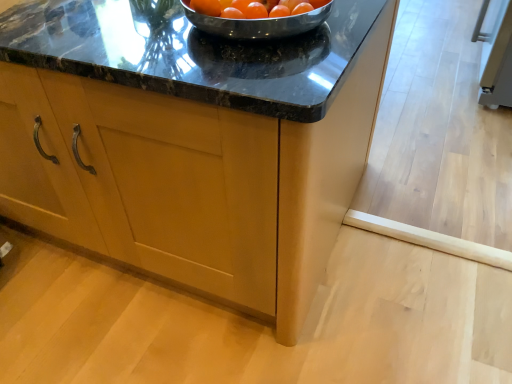
Question: Is matte wood cabinet at center taller than orange matte tomato at center?

Choices:
 (A) yes
 (B) no

Answer: (A)

Question: Can you confirm if matte wood cabinet at center is bigger than orange matte tomato at center?

Choices:
 (A) no
 (B) yes

Answer: (B)

Question: Does matte wood cabinet at center have a smaller size compared to orange matte tomato at center?

Choices:
 (A) yes
 (B) no

Answer: (B)

Question: From a real-world perspective, is matte wood cabinet at center physically above orange matte tomato at center?

Choices:
 (A) no
 (B) yes

Answer: (A)

Question: From a real-world perspective, is matte wood cabinet at center below orange matte tomato at center?

Choices:
 (A) yes
 (B) no

Answer: (A)

Question: Is orange matte tomato at center surrounded by matte wood cabinet at center?

Choices:
 (A) no
 (B) yes

Answer: (A)

Question: Is orange matte tomato at center completely or partially outside of matte wood cabinet at center?

Choices:
 (A) yes
 (B) no

Answer: (A)

Question: Is orange matte tomato at center closer to camera compared to matte wood cabinet at center?

Choices:
 (A) no
 (B) yes

Answer: (A)

Question: From a real-world perspective, is orange matte tomato at center on top of matte wood cabinet at center?

Choices:
 (A) yes
 (B) no

Answer: (A)

Question: Is the surface of orange matte tomato at center in direct contact with matte wood cabinet at center?

Choices:
 (A) yes
 (B) no

Answer: (B)

Question: Is orange matte tomato at center to the right of matte wood cabinet at center from the viewer's perspective?

Choices:
 (A) yes
 (B) no

Answer: (A)

Question: From the image's perspective, would you say orange matte tomato at center is positioned over matte wood cabinet at center?

Choices:
 (A) no
 (B) yes

Answer: (B)

Question: Is point click(x=268, y=11) closer or farther from the camera than point click(x=217, y=120)?

Choices:
 (A) farther
 (B) closer

Answer: (A)